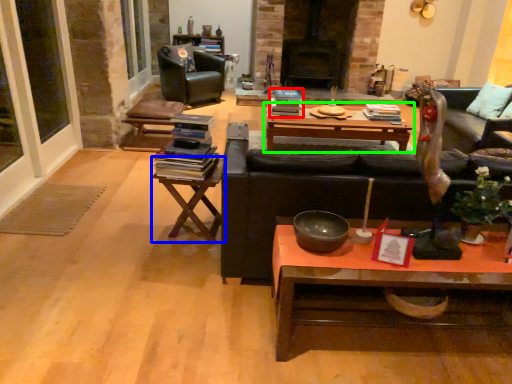
Question: Which is farther away from book (highlighted by a red box)? table (highlighted by a blue box) or coffee table (highlighted by a green box)?

Choices:
 (A) table
 (B) coffee table

Answer: (A)